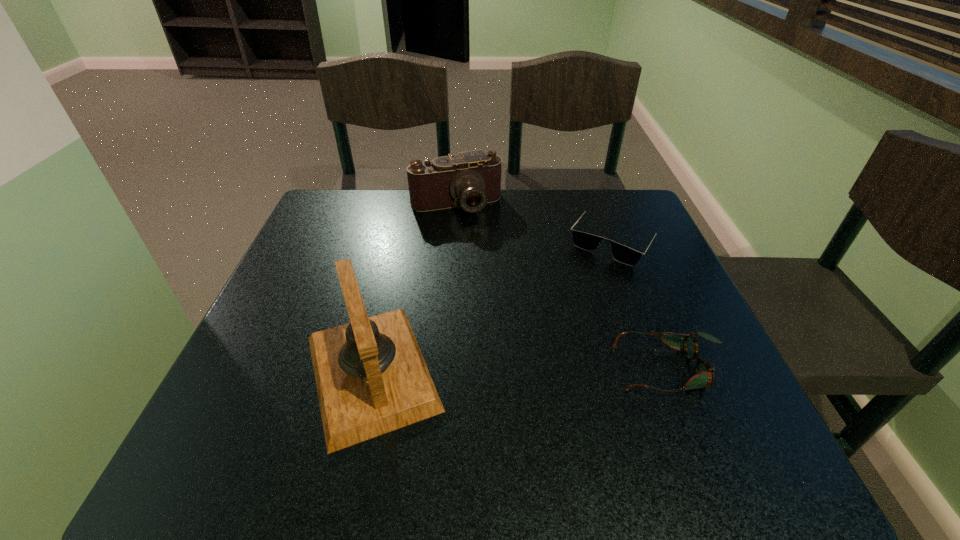
Find the location of a particular element. This screenshot has height=540, width=960. vacant space on the desktop that is between the tallest object and the spectacles and is positioned on the front-facing side of the camera is located at coordinates (523, 370).

I want to click on vacant space on the desktop that is between the bell and the spectacles and is positioned on the front-facing side of the sunglasses, so click(522, 370).